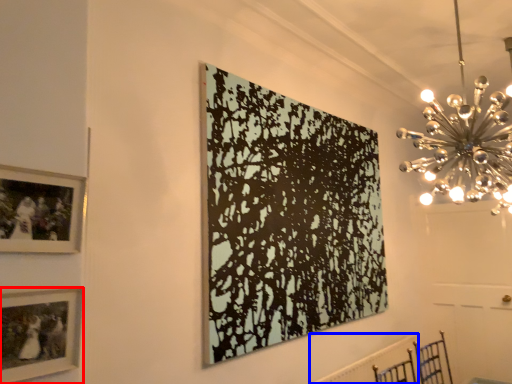
Question: Which of the following is the farthest to the observer, picture frame (highlighted by a red box) or radiator (highlighted by a blue box)?

Choices:
 (A) picture frame
 (B) radiator

Answer: (B)